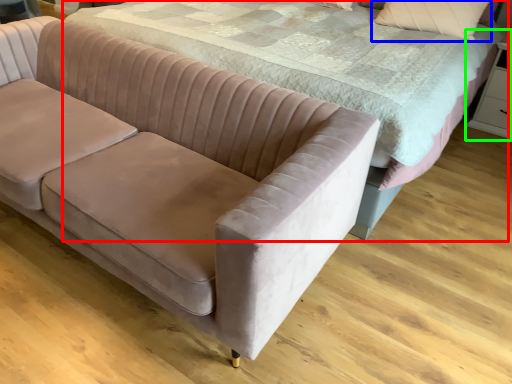
Question: Based on their relative distances, which object is nearer to bed (highlighted by a red box)? Choose from pillow (highlighted by a blue box) and dresser (highlighted by a green box).

Choices:
 (A) pillow
 (B) dresser

Answer: (A)